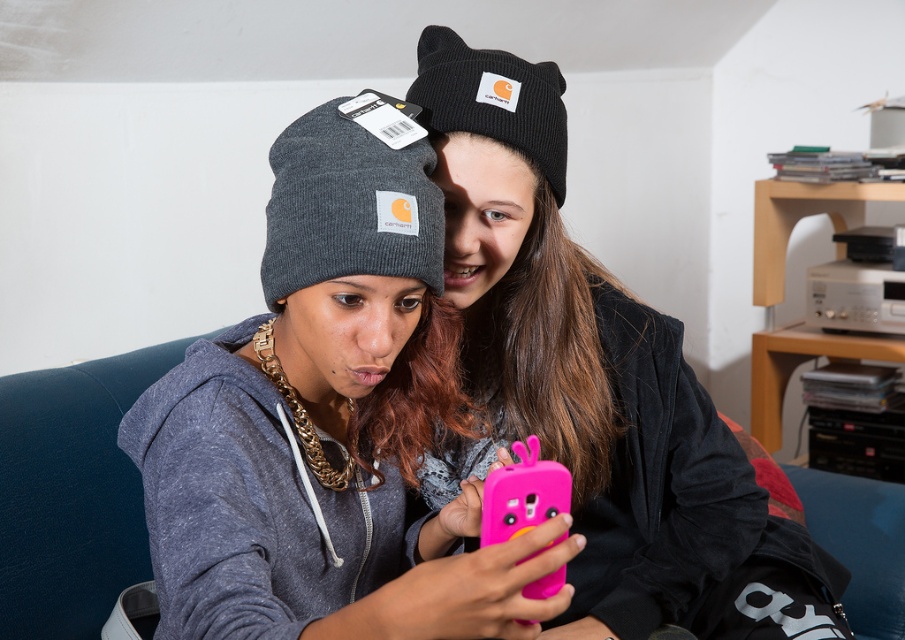
You are a photographer trying to capture a closeup of the pink rubber phone case at center without the matte black beanie at center blocking it. Based on their current positions, is this possible?

The matte black beanie at center is positioned over the pink rubber phone case at center, so it is blocking it. Therefore, capturing a clear closeup without the beanie would not be possible in their current positions.

You are standing in front of the image and want to locate the matte gray beanie at center. What are its coordinates?

The coordinates of the matte gray beanie at center are at point (x=319, y=428).

You are a photographer taking a picture of two people sitting together. You notice the matte gray beanie at center and the matte black beanie at center. Which beanie will appear closer to the camera in the photo?

The matte gray beanie at center appears closer to the camera because it is in front of the matte black beanie at center in the image.